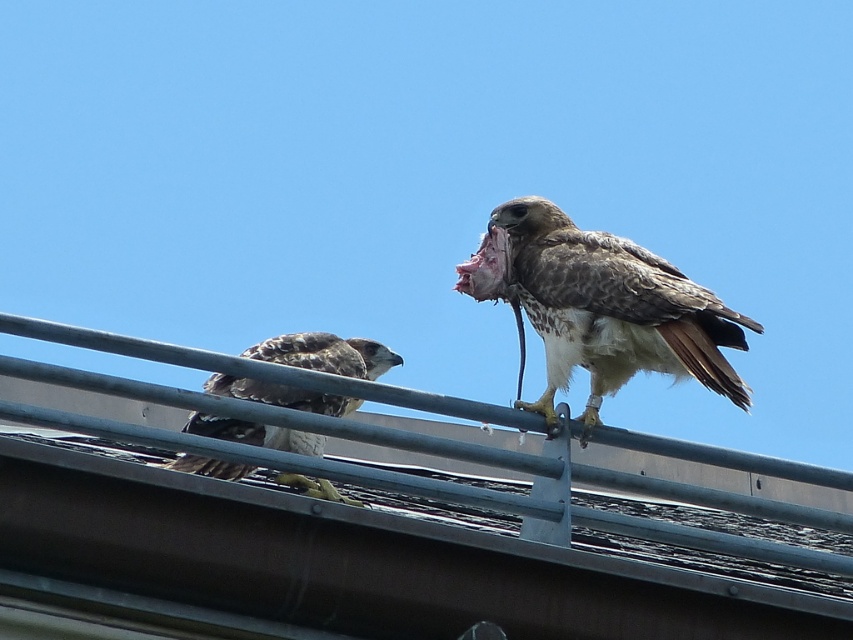
Measure the distance between brown speckled feathers at upper right and brown speckled feathers at center.

The distance of brown speckled feathers at upper right from brown speckled feathers at center is 3.35 feet.

Based on the photo, is brown speckled feathers at upper right behind brown speckled feathers at center?

No, it is not.

This screenshot has width=853, height=640. Identify the location of brown speckled feathers at upper right. (601, 307).

Locate an element on the screen. The width and height of the screenshot is (853, 640). brown speckled feathers at upper right is located at coordinates (601, 307).

Who is more distant from viewer, (817,512) or (508,262)?

The point (508,262) is more distant.

What do you see at coordinates (355, 561) in the screenshot?
I see `metallic gray roof at center` at bounding box center [355, 561].

This screenshot has width=853, height=640. What are the coordinates of `metallic gray roof at center` in the screenshot? It's located at pos(355,561).

Which of these two, metallic gray roof at center or brown speckled feathers at center, stands shorter?

Standing shorter between the two is brown speckled feathers at center.

Is metallic gray roof at center bigger than brown speckled feathers at center?

Yes, metallic gray roof at center is bigger than brown speckled feathers at center.

This screenshot has height=640, width=853. What are the coordinates of `metallic gray roof at center` in the screenshot? It's located at (355, 561).